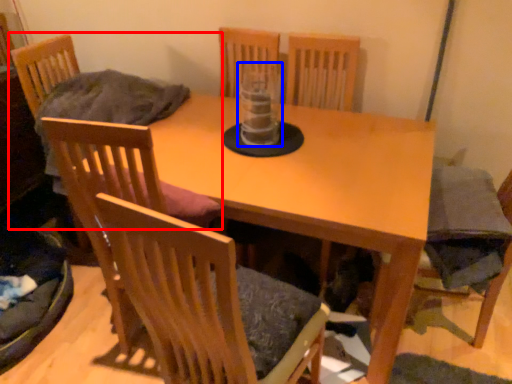
Question: Which of the following is the closest to the observer, chair (highlighted by a red box) or glass vase (highlighted by a blue box)?

Choices:
 (A) chair
 (B) glass vase

Answer: (B)